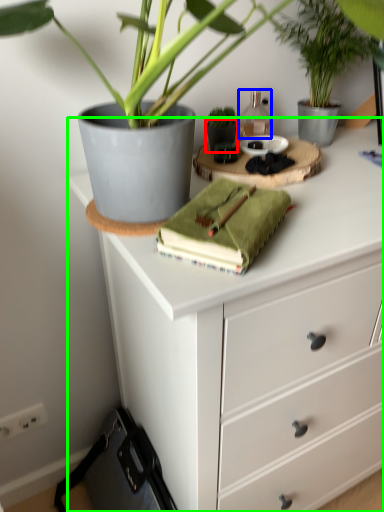
Question: Based on their relative distances, which object is farther from flowerpot (highlighted by a red box)? Choose from bottle (highlighted by a blue box) and chest of drawers (highlighted by a green box).

Choices:
 (A) bottle
 (B) chest of drawers

Answer: (B)